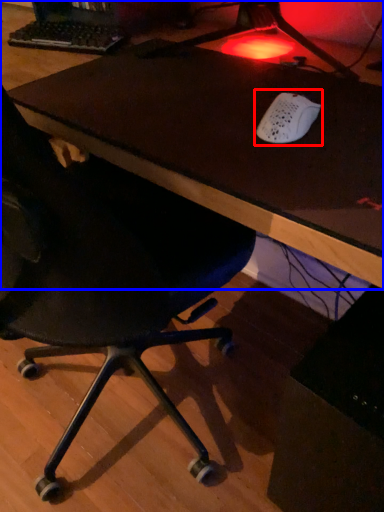
Question: Which object appears farthest to the camera in this image, mouse (highlighted by a red box) or table (highlighted by a blue box)?

Choices:
 (A) mouse
 (B) table

Answer: (A)